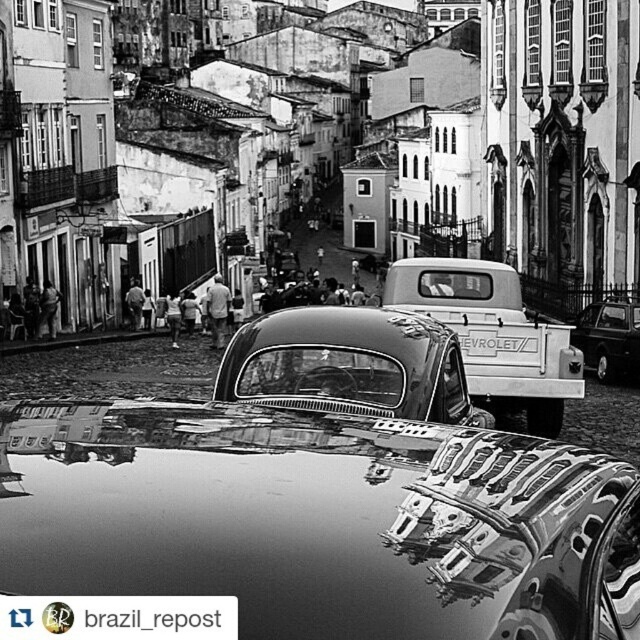
Between shiny black car at center and shiny chrome pickup truck at center, which one is positioned lower?

Positioned lower is shiny black car at center.

Is shiny black car at center to the right of shiny chrome pickup truck at center from the viewer's perspective?

Incorrect, shiny black car at center is not on the right side of shiny chrome pickup truck at center.

The height and width of the screenshot is (640, 640). What do you see at coordinates (320, 518) in the screenshot?
I see `shiny black car at center` at bounding box center [320, 518].

Locate an element on the screen. shiny black car at center is located at coordinates (320, 518).

Consider the image. Is white matte chevrolet truck at center above shiny chrome pickup truck at center?

Indeed, white matte chevrolet truck at center is positioned over shiny chrome pickup truck at center.

What do you see at coordinates (493, 333) in the screenshot?
I see `white matte chevrolet truck at center` at bounding box center [493, 333].

Where is `white matte chevrolet truck at center`? The width and height of the screenshot is (640, 640). white matte chevrolet truck at center is located at coordinates (493, 333).

Is shiny black car at center thinner than white matte chevrolet truck at center?

Incorrect, shiny black car at center's width is not less than white matte chevrolet truck at center's.

Which of these two, shiny black car at center or white matte chevrolet truck at center, stands shorter?

shiny black car at center is shorter.

Who is more distant from viewer, (52,541) or (518,339)?

Positioned behind is point (518,339).

Find the location of a particular element. shiny black car at center is located at coordinates (320, 518).